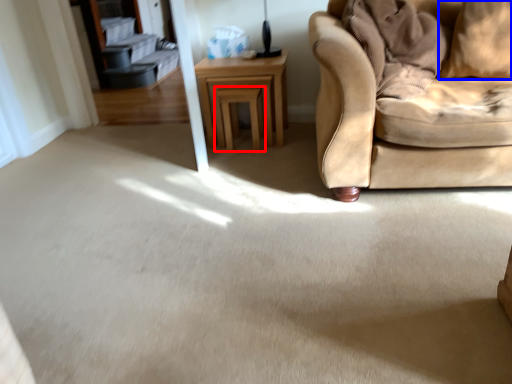
Question: Which point is further to the camera, stool (highlighted by a red box) or pillow (highlighted by a blue box)?

Choices:
 (A) stool
 (B) pillow

Answer: (A)